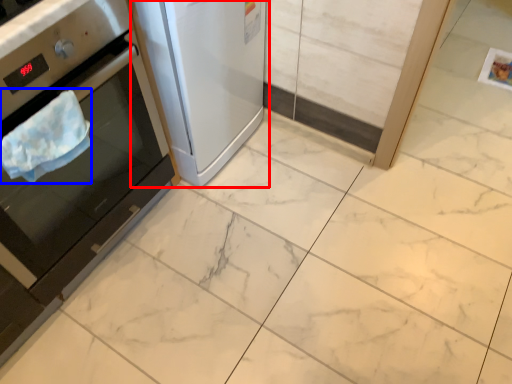
Question: Which point is further to the camera, home appliance (highlighted by a red box) or blanket (highlighted by a blue box)?

Choices:
 (A) home appliance
 (B) blanket

Answer: (A)